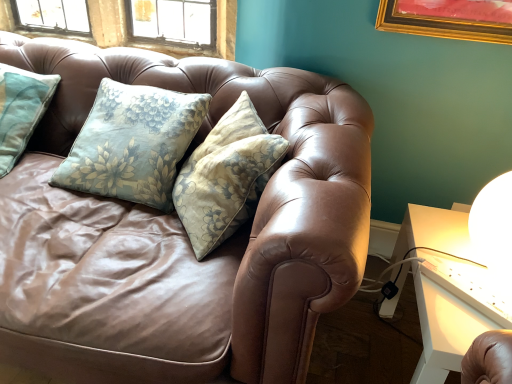
Question: Is white glossy table at right positioned before brown leather couch at center?

Choices:
 (A) no
 (B) yes

Answer: (A)

Question: Is white glossy table at right far away from brown leather couch at center?

Choices:
 (A) yes
 (B) no

Answer: (B)

Question: Considering the relative sizes of white glossy table at right and brown leather couch at center in the image provided, is white glossy table at right wider than brown leather couch at center?

Choices:
 (A) no
 (B) yes

Answer: (A)

Question: From a real-world perspective, is white glossy table at right positioned over brown leather couch at center based on gravity?

Choices:
 (A) yes
 (B) no

Answer: (B)

Question: From the image's perspective, would you say white glossy table at right is positioned over brown leather couch at center?

Choices:
 (A) yes
 (B) no

Answer: (B)

Question: Can you confirm if white glossy table at right is smaller than brown leather couch at center?

Choices:
 (A) yes
 (B) no

Answer: (A)

Question: Is brown leather couch at center bigger than white glossy table at right?

Choices:
 (A) no
 (B) yes

Answer: (B)

Question: Is brown leather couch at center far from white glossy table at right?

Choices:
 (A) no
 (B) yes

Answer: (A)

Question: Is the position of brown leather couch at center less distant than that of white glossy table at right?

Choices:
 (A) no
 (B) yes

Answer: (B)

Question: Is brown leather couch at center taller than white glossy table at right?

Choices:
 (A) no
 (B) yes

Answer: (B)

Question: Is brown leather couch at center positioned behind white glossy table at right?

Choices:
 (A) no
 (B) yes

Answer: (A)

Question: Does brown leather couch at center appear on the left side of white glossy table at right?

Choices:
 (A) yes
 (B) no

Answer: (A)

Question: From the image's perspective, is brown leather couch at center above or below white glossy table at right?

Choices:
 (A) below
 (B) above

Answer: (B)